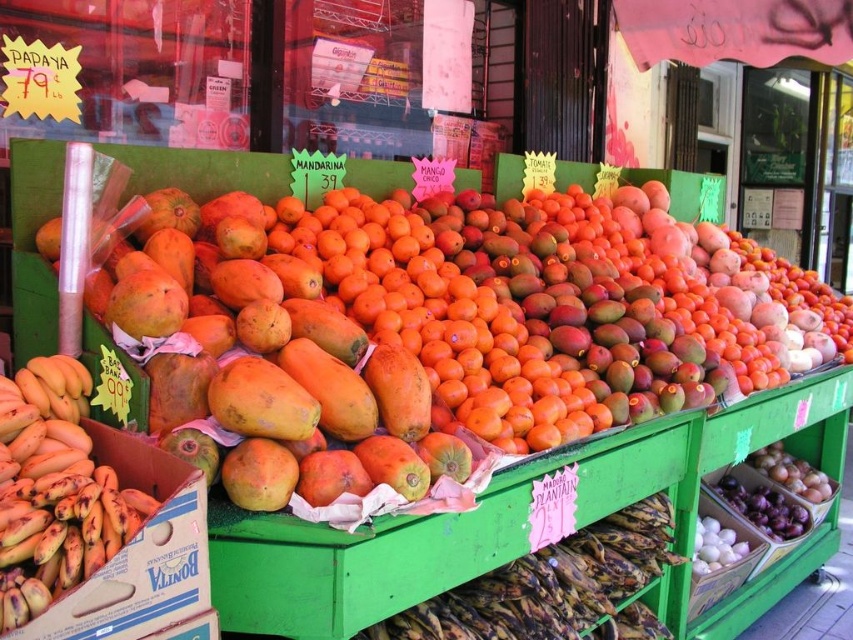
Is ripe papaya at center below yellow matte bananas at left?

No, ripe papaya at center is not below yellow matte bananas at left.

Can you confirm if ripe papaya at center is positioned to the right of yellow matte bananas at left?

Indeed, ripe papaya at center is positioned on the right side of yellow matte bananas at left.

Does point (419, 493) lie in front of point (135, 493)?

No, (419, 493) is further to viewer.

Where is `ripe papaya at center`? The image size is (853, 640). ripe papaya at center is located at coordinates (271, 369).